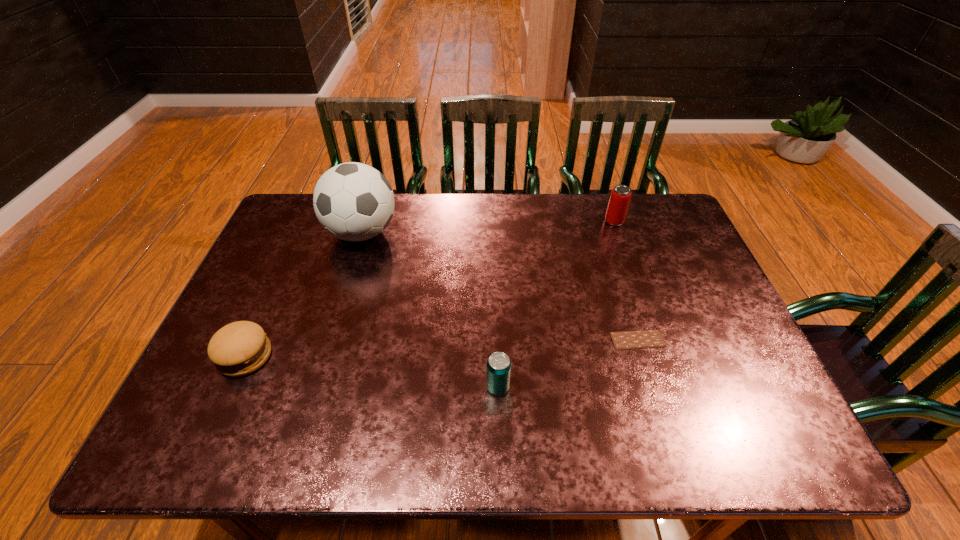
The height and width of the screenshot is (540, 960). I want to click on vacant region at the near edge, so click(x=431, y=444).

In the image, there is a desktop. At what (x,y) coordinates should I click in order to perform the action: click on vacant space at the right edge. Please return your answer as a coordinate pair (x, y). Looking at the image, I should click on (648, 250).

Where is `free space at the far left corner of the desktop`? Image resolution: width=960 pixels, height=540 pixels. free space at the far left corner of the desktop is located at coordinates (307, 225).

Locate an element on the screen. free location at the near left corner is located at coordinates [x=191, y=422].

Image resolution: width=960 pixels, height=540 pixels. Identify the location of vacant space at the near right corner of the desktop. (785, 423).

The image size is (960, 540). I want to click on free space between the fourth shortest object and the shorter beer can, so click(x=556, y=304).

The height and width of the screenshot is (540, 960). Identify the location of free spot between the farther beer can and the shortest object. (626, 281).

Locate an element on the screen. The width and height of the screenshot is (960, 540). blank region between the fourth tallest object and the right beer can is located at coordinates (430, 289).

I want to click on free space that is in between the fourth tallest object and the second object from left to right, so click(x=303, y=295).

Where is `vacant area that lies between the tallest object and the shortest object`? This screenshot has width=960, height=540. vacant area that lies between the tallest object and the shortest object is located at coordinates (500, 286).